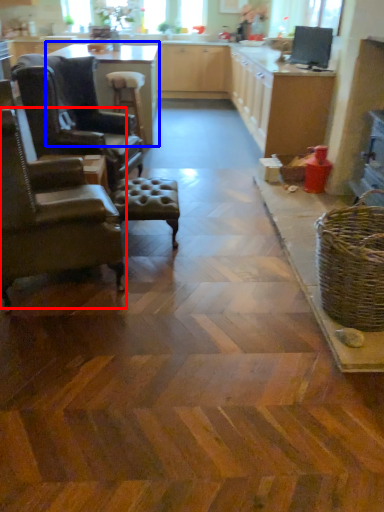
Question: Which of the following is the closest to the observer, chair (highlighted by a red box) or table (highlighted by a blue box)?

Choices:
 (A) chair
 (B) table

Answer: (A)